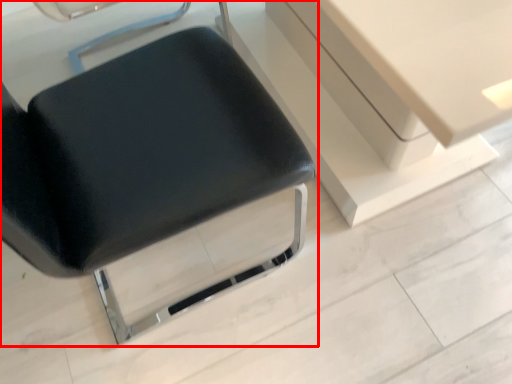
Question: Observing the image, what is the correct spatial positioning of chair (annotated by the red box) in reference to vanity?

Choices:
 (A) left
 (B) right

Answer: (A)